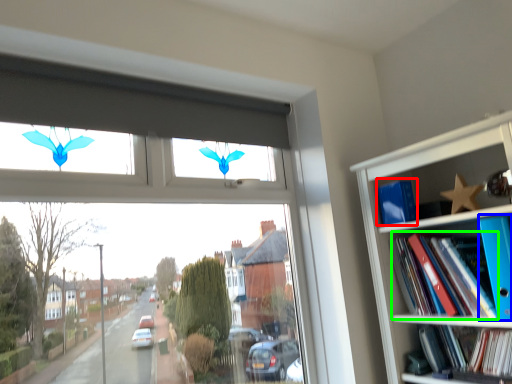
Question: Based on their relative distances, which object is nearer to paperback book (highlighted by a red box)? Choose from paperback book (highlighted by a blue box) and book (highlighted by a green box).

Choices:
 (A) paperback book
 (B) book

Answer: (B)